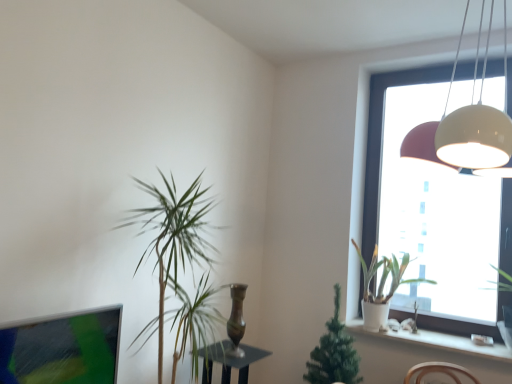
Question: Is matte white pendant light at upper right taller than bronze metallic vase at center?

Choices:
 (A) yes
 (B) no

Answer: (A)

Question: From the image's perspective, does matte white pendant light at upper right appear lower than bronze metallic vase at center?

Choices:
 (A) no
 (B) yes

Answer: (A)

Question: Is matte white pendant light at upper right not near bronze metallic vase at center?

Choices:
 (A) yes
 (B) no

Answer: (A)

Question: Can you confirm if matte white pendant light at upper right is smaller than bronze metallic vase at center?

Choices:
 (A) no
 (B) yes

Answer: (A)

Question: From a real-world perspective, is matte white pendant light at upper right over bronze metallic vase at center?

Choices:
 (A) yes
 (B) no

Answer: (A)

Question: Is matte white pendant light at upper right placed right next to bronze metallic vase at center?

Choices:
 (A) no
 (B) yes

Answer: (A)

Question: Is white glossy window at upper right oriented towards white matte pot at window, arranged as the second houseplant when viewed from the left?

Choices:
 (A) yes
 (B) no

Answer: (A)

Question: Can you confirm if white glossy window at upper right is shorter than white matte pot at window, which is counted as the 2th houseplant, starting from the right?

Choices:
 (A) yes
 (B) no

Answer: (B)

Question: Are white glossy window at upper right and white matte pot at window, which is counted as the 2th houseplant, starting from the right, located far from each other?

Choices:
 (A) no
 (B) yes

Answer: (A)

Question: Can you confirm if white glossy window at upper right is positioned to the left of white matte pot at window, which is counted as the 2th houseplant, starting from the right?

Choices:
 (A) no
 (B) yes

Answer: (A)

Question: Would you say white glossy window at upper right is outside white matte pot at window, which is counted as the 2th houseplant, starting from the right?

Choices:
 (A) no
 (B) yes

Answer: (B)

Question: From the image's perspective, is white glossy window at upper right located beneath white matte pot at window, arranged as the second houseplant when viewed from the left?

Choices:
 (A) yes
 (B) no

Answer: (B)

Question: Is white matte pot at window, which is counted as the 2th houseplant, starting from the right, at the left side of green leafy plant at window, which is the first houseplant from right to left?

Choices:
 (A) yes
 (B) no

Answer: (A)